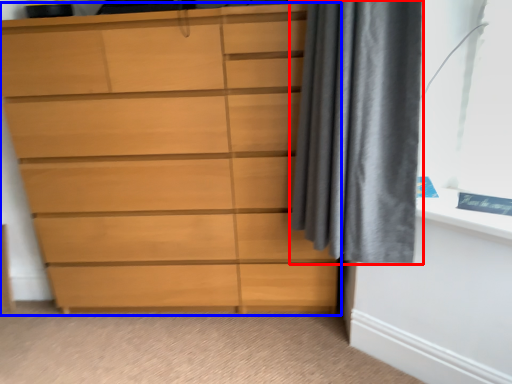
Question: Which point is closer to the camera, curtain (highlighted by a red box) or chest of drawers (highlighted by a blue box)?

Choices:
 (A) curtain
 (B) chest of drawers

Answer: (A)